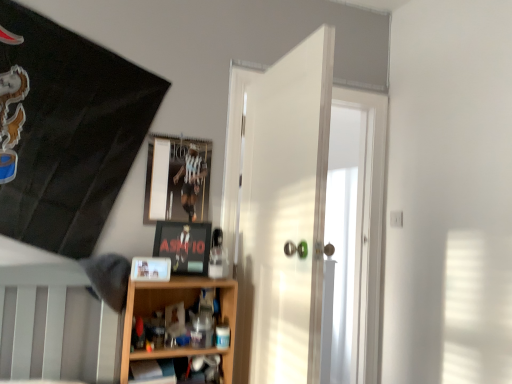
Question: Are wooden shelf at lower center, which ranks as the first shelf in top-to-bottom order, and matte black picture frame at center, which ranks as the 2th picture frame in top-to-bottom order, located far from each other?

Choices:
 (A) yes
 (B) no

Answer: (B)

Question: Is wooden shelf at lower center, the 2th shelf when ordered from bottom to top, at the right side of matte black picture frame at center, which ranks as the 2th picture frame in top-to-bottom order?

Choices:
 (A) no
 (B) yes

Answer: (A)

Question: Does wooden shelf at lower center, which ranks as the first shelf in top-to-bottom order, have a greater width compared to matte black picture frame at center, placed as the 2th picture frame when sorted from bottom to top?

Choices:
 (A) no
 (B) yes

Answer: (B)

Question: Is wooden shelf at lower center, the 2th shelf when ordered from bottom to top, touching matte black picture frame at center, marked as the second picture frame in a back-to-front arrangement?

Choices:
 (A) yes
 (B) no

Answer: (B)

Question: From a real-world perspective, is wooden shelf at lower center, which ranks as the first shelf in top-to-bottom order, under matte black picture frame at center, which is the 2th picture frame in front-to-back order?

Choices:
 (A) yes
 (B) no

Answer: (A)

Question: Does point (197, 364) appear closer or farther from the camera than point (148, 196)?

Choices:
 (A) farther
 (B) closer

Answer: (B)

Question: Considering the positions of wooden shelf at lower center, which is counted as the second shelf, starting from the top, and metallic reflective frame at upper center, which appears as the 1th picture frame when viewed from the top, in the image, is wooden shelf at lower center, which is counted as the second shelf, starting from the top, wider or thinner than metallic reflective frame at upper center, which appears as the 1th picture frame when viewed from the top,?

Choices:
 (A) thin
 (B) wide

Answer: (B)

Question: Considering the positions of wooden shelf at lower center, the 1th shelf ordered from the bottom, and metallic reflective frame at upper center, marked as the 3th picture frame in a bottom-to-top arrangement, in the image, is wooden shelf at lower center, the 1th shelf ordered from the bottom, bigger or smaller than metallic reflective frame at upper center, marked as the 3th picture frame in a bottom-to-top arrangement,?

Choices:
 (A) small
 (B) big

Answer: (B)

Question: Considering their positions, is wooden shelf at lower center, which is counted as the second shelf, starting from the top, located in front of or behind metallic reflective frame at upper center, marked as the 3th picture frame in a bottom-to-top arrangement?

Choices:
 (A) front
 (B) behind

Answer: (A)

Question: From the image's perspective, is white glossy door at center above or below matte plastic picture frame at center, the 3th picture frame positioned from the top?

Choices:
 (A) above
 (B) below

Answer: (A)

Question: Is white glossy door at center in front of or behind matte plastic picture frame at center, which is the 1th picture frame from front to back, in the image?

Choices:
 (A) behind
 (B) front

Answer: (B)

Question: From a real-world perspective, is white glossy door at center above or below matte plastic picture frame at center, which is counted as the first picture frame, starting from the bottom?

Choices:
 (A) above
 (B) below

Answer: (A)

Question: Considering the positions of white glossy door at center and matte plastic picture frame at center, placed as the 3th picture frame when sorted from back to front, in the image, is white glossy door at center bigger or smaller than matte plastic picture frame at center, placed as the 3th picture frame when sorted from back to front,?

Choices:
 (A) big
 (B) small

Answer: (A)

Question: Would you say wooden shelf at lower center, the 2th shelf when ordered from bottom to top, is to the left or to the right of metallic reflective frame at upper center, which is the first picture frame from back to front, in the picture?

Choices:
 (A) left
 (B) right

Answer: (B)

Question: From a real-world perspective, is wooden shelf at lower center, which ranks as the first shelf in top-to-bottom order, positioned above or below metallic reflective frame at upper center, which appears as the 1th picture frame when viewed from the top?

Choices:
 (A) below
 (B) above

Answer: (A)